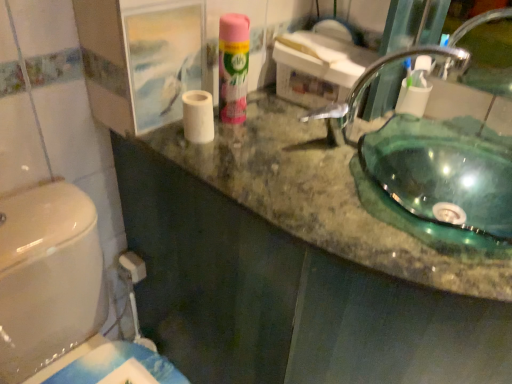
Question: Relative to white matte toilet paper at center, which is the 2th toilet paper from right to left, is green marble counter top at center in front or behind?

Choices:
 (A) front
 (B) behind

Answer: (A)

Question: Is green marble counter top at center situated inside white matte toilet paper at center, the 1th toilet paper from the left, or outside?

Choices:
 (A) outside
 (B) inside

Answer: (A)

Question: Which of these objects is positioned farthest from the white matte toilet paper at center, marked as the 1th toilet paper in a front-to-back arrangement?

Choices:
 (A) transparent glass sink at upper right
 (B) green marble counter top at center
 (C) white matte toilet paper at upper right, the first toilet paper when ordered from back to front
 (D) pink matte air freshener at upper center

Answer: (C)

Question: Based on their relative distances, which object is farther from the white matte toilet paper at upper right, positioned as the second toilet paper in left-to-right order?

Choices:
 (A) transparent glass sink at upper right
 (B) pink matte air freshener at upper center
 (C) green marble counter top at center
 (D) white matte toilet paper at center, marked as the second toilet paper in a back-to-front arrangement

Answer: (D)